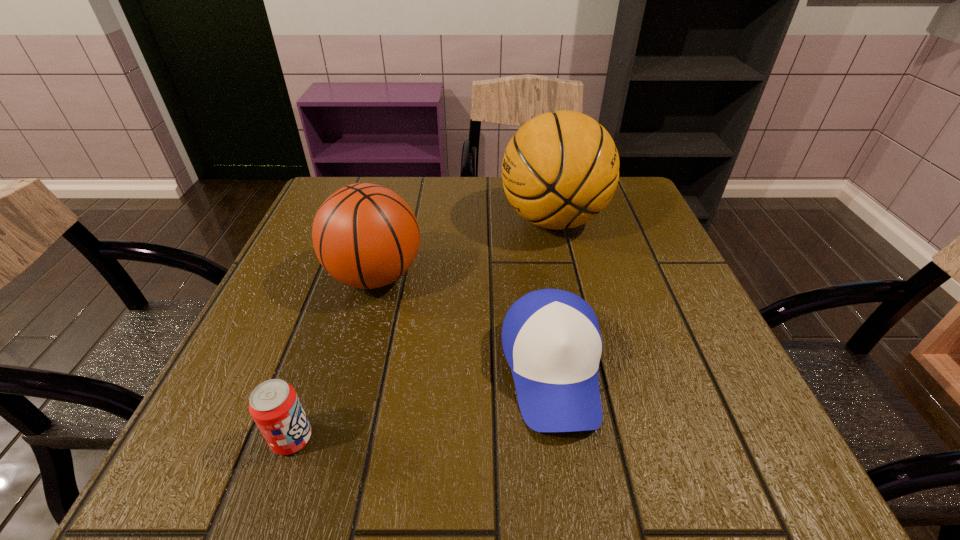
Where is `the right basketball`? the right basketball is located at coordinates (561, 169).

Where is `the taller basketball`? The image size is (960, 540). the taller basketball is located at coordinates [561, 169].

I want to click on the shorter basketball, so click(x=366, y=236).

I want to click on the third shortest object, so click(366, 236).

Locate an element on the screen. The width and height of the screenshot is (960, 540). baseball cap is located at coordinates (551, 339).

This screenshot has height=540, width=960. I want to click on soda can, so click(274, 405).

Where is `vacant space located 0.230m on the surface of the tallest object near the brand logo`? vacant space located 0.230m on the surface of the tallest object near the brand logo is located at coordinates (404, 220).

Identify the location of free space located on the surface of the tallest object near the brand logo. (400, 220).

Locate an element on the screen. This screenshot has height=540, width=960. vacant space located 0.270m on the surface of the tallest object near the brand logo is located at coordinates (388, 220).

Where is `vacant space located on the right of the second tallest object`? This screenshot has height=540, width=960. vacant space located on the right of the second tallest object is located at coordinates (512, 276).